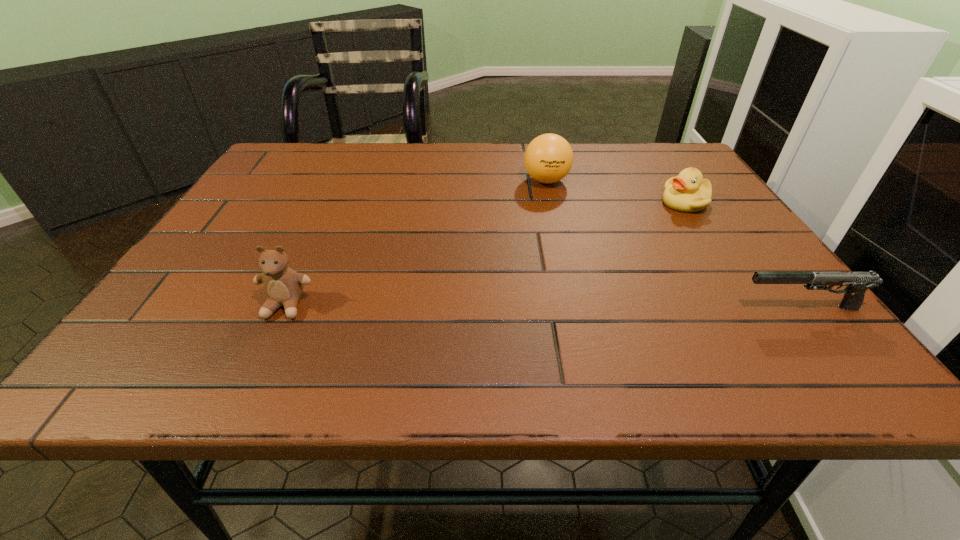
The width and height of the screenshot is (960, 540). Find the location of `vacant area that lies between the teddy bear and the duckling`. vacant area that lies between the teddy bear and the duckling is located at coordinates (486, 254).

Find the location of `free space between the gun and the duckling`. free space between the gun and the duckling is located at coordinates (743, 255).

Locate an element on the screen. Image resolution: width=960 pixels, height=540 pixels. free space between the ping-pong ball and the duckling is located at coordinates (615, 192).

Where is `object identified as the third closest to the ping-pong ball`? The width and height of the screenshot is (960, 540). object identified as the third closest to the ping-pong ball is located at coordinates (283, 286).

Locate which object ranks in proximity to the second object from left to right. Please provide its 2D coordinates. Your answer should be formatted as a tuple, i.e. [(x, y)], where the tuple contains the x and y coordinates of a point satisfying the conditions above.

[(687, 192)]

Where is `vacant region that satisfies the following two spatial constraints: 1. on the front-facing side of the teddy bear; 2. at the muzzle end of the gun`? The image size is (960, 540). vacant region that satisfies the following two spatial constraints: 1. on the front-facing side of the teddy bear; 2. at the muzzle end of the gun is located at coordinates (284, 308).

Where is `vacant region that satisfies the following two spatial constraints: 1. on the front-facing side of the teddy bear; 2. at the muzzle end of the gun`? This screenshot has height=540, width=960. vacant region that satisfies the following two spatial constraints: 1. on the front-facing side of the teddy bear; 2. at the muzzle end of the gun is located at coordinates (284, 308).

The width and height of the screenshot is (960, 540). In order to click on blank space that satisfies the following two spatial constraints: 1. on the front-facing side of the teddy bear; 2. at the muzzle end of the gun in this screenshot , I will do `click(284, 308)`.

Locate an element on the screen. Image resolution: width=960 pixels, height=540 pixels. free spot that satisfies the following two spatial constraints: 1. on the front side of the duckling; 2. on the left side of the third object from right to left is located at coordinates (551, 202).